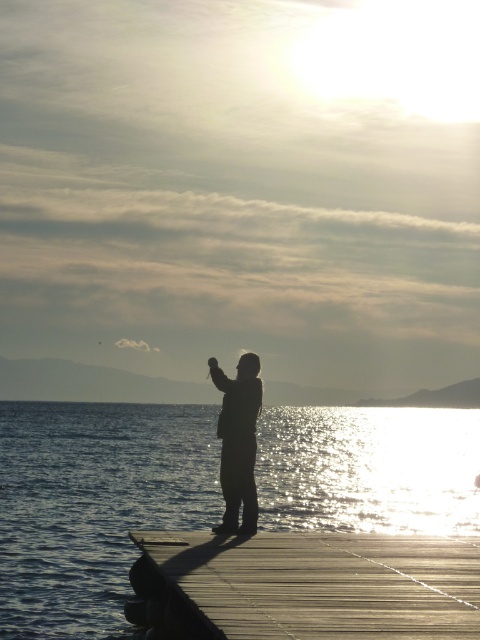
Does shiny blue water at center have a lesser width compared to silhouette figure at center?

No, shiny blue water at center is not thinner than silhouette figure at center.

Can you confirm if shiny blue water at center is bigger than silhouette figure at center?

Yes.

Between point (215, 451) and point (252, 513), which one is positioned in front?

Point (252, 513)

The height and width of the screenshot is (640, 480). What are the coordinates of `shiny blue water at center` in the screenshot? It's located at (94, 506).

Who is more distant from viewer, (192,566) or (240,396)?

Point (240,396)

Measure the distance between wooden at center and silhouette figure at center.

wooden at center and silhouette figure at center are 7.74 feet apart from each other.

Which is in front, point (225, 541) or point (248, 524)?

Point (225, 541) is in front.

The width and height of the screenshot is (480, 640). In order to click on wooden at center in this screenshot , I will do `click(324, 582)`.

Is shiny blue water at center taller than wooden at center?

Yes.

Is shiny blue water at center thinner than wooden at center?

No, shiny blue water at center is not thinner than wooden at center.

Who is more forward, (168, 461) or (450, 604)?

Point (450, 604)

In order to click on shiny blue water at center in this screenshot , I will do `click(94, 506)`.